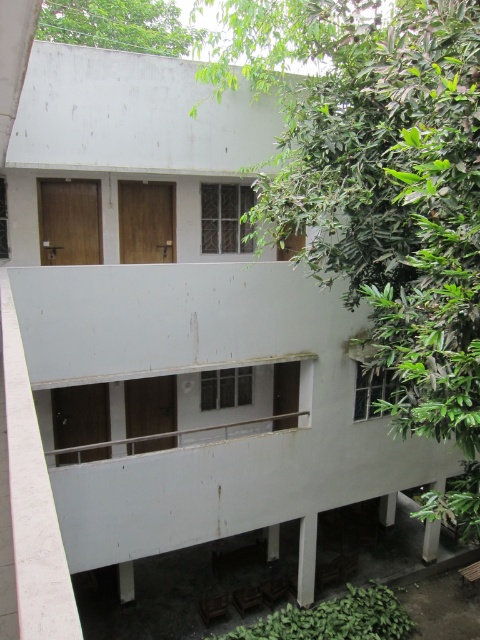
You are an architect designing a new building and want to ensure that the green leafy tree at upper right and the green leafy tree at upper left are balanced in terms of visual impact. Based on their current placement, which tree might need adjustment to achieve symmetry?

The green leafy tree at upper right occupies less space than the green leafy tree at upper left, so it might need to be made larger or positioned to take up more space to achieve symmetry.